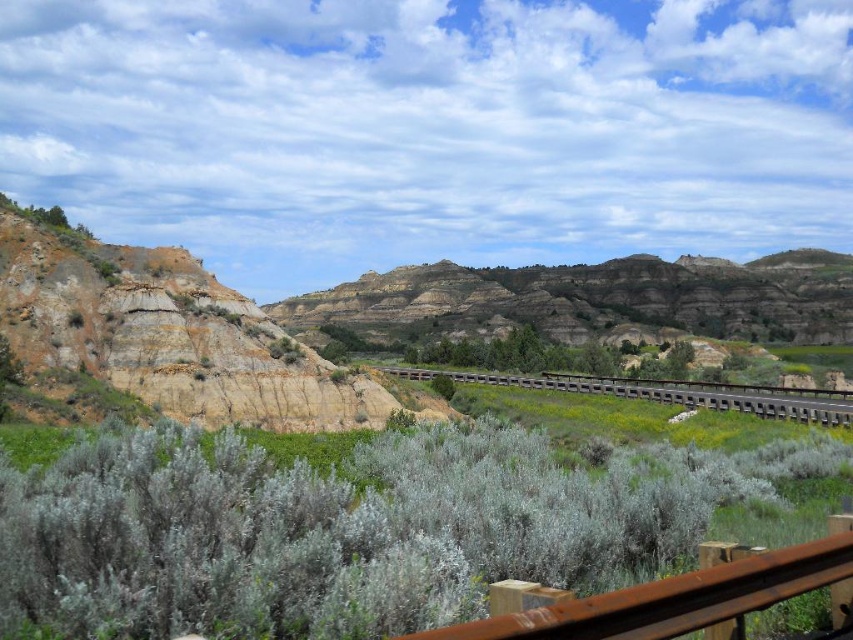
How far apart are green fuzzy bush at center and rustic brown rock formation at center?

green fuzzy bush at center and rustic brown rock formation at center are 339.71 meters apart.

Between green fuzzy bush at center and rustic brown rock formation at center, which one is positioned higher?

Positioned higher is rustic brown rock formation at center.

Which is in front, point (206, 579) or point (759, 310)?

Point (206, 579) is in front.

Locate an element on the screen. The image size is (853, 640). green fuzzy bush at center is located at coordinates (345, 529).

Is green fuzzy bush at center positioned at the back of brown wooden rail at center?

No.

Does green fuzzy bush at center appear under brown wooden rail at center?

No, green fuzzy bush at center is not below brown wooden rail at center.

Locate an element on the screen. The image size is (853, 640). green fuzzy bush at center is located at coordinates (345, 529).

Does rusty metal rail at lower right have a smaller size compared to brown wooden rail at center?

Correct, rusty metal rail at lower right occupies less space than brown wooden rail at center.

At what (x,y) coordinates should I click in order to perform the action: click on rusty metal rail at lower right. Please return your answer as a coordinate pair (x, y). This screenshot has height=640, width=853. Looking at the image, I should click on click(672, 598).